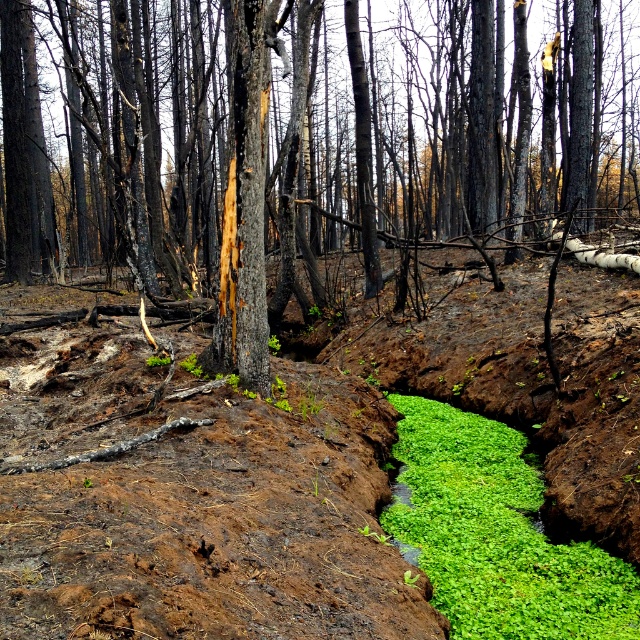
Question: Which of the following is the farthest from the observer?

Choices:
 (A) (67, 561)
 (B) (474, 19)
 (C) (557, 634)

Answer: (B)

Question: Can you confirm if charred bark tree at center is smaller than green leafy algae at center?

Choices:
 (A) yes
 (B) no

Answer: (B)

Question: Can you confirm if charred bark tree at center is wider than green leafy algae at center?

Choices:
 (A) no
 (B) yes

Answer: (B)

Question: Is charred bark tree at center smaller than green leafy algae at center?

Choices:
 (A) yes
 (B) no

Answer: (B)

Question: Which point is farther to the camera?

Choices:
 (A) charred bark tree at center
 (B) green leafy algae at center

Answer: (A)

Question: Which object is farther from the camera taking this photo?

Choices:
 (A) green leafy algae at center
 (B) charred bark tree at center

Answer: (B)